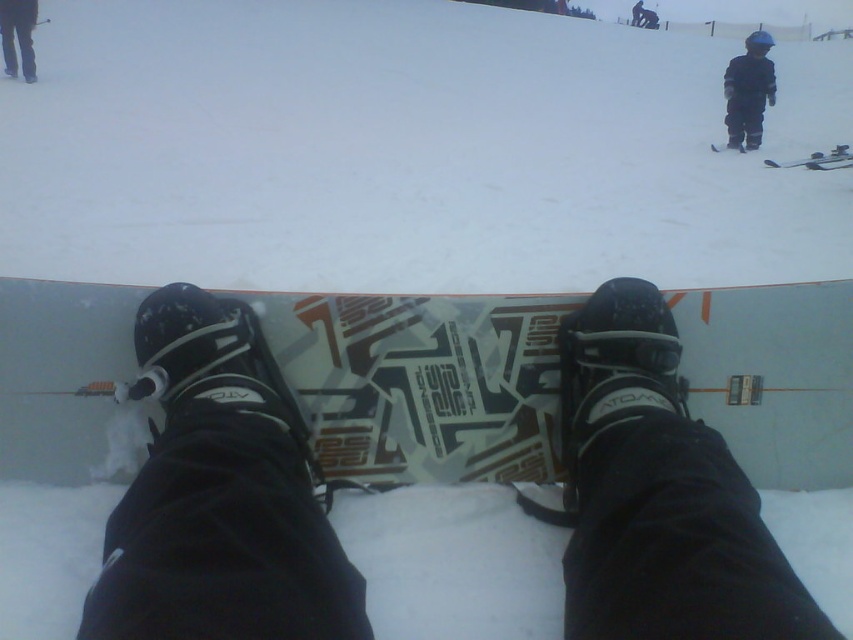
Question: Which point is closer to the camera?

Choices:
 (A) (35, 6)
 (B) (737, 129)
 (C) (381, 468)

Answer: (C)

Question: Estimate the real-world distances between objects in this image. Which object is closer to the black matte snowsuit at upper right?

Choices:
 (A) matte black snowboard at center
 (B) black fabric pants at upper left

Answer: (A)

Question: Is black matte snowsuit at upper right thinner than black fabric pants at upper left?

Choices:
 (A) yes
 (B) no

Answer: (B)

Question: Observing the image, what is the correct spatial positioning of matte black snowboard at center in reference to black matte snowsuit at upper right?

Choices:
 (A) right
 (B) left

Answer: (B)

Question: Is matte black snowboard at center smaller than black fabric pants at upper left?

Choices:
 (A) yes
 (B) no

Answer: (A)

Question: Among these objects, which one is nearest to the camera?

Choices:
 (A) matte black snowboard at center
 (B) black fabric pants at upper left

Answer: (A)